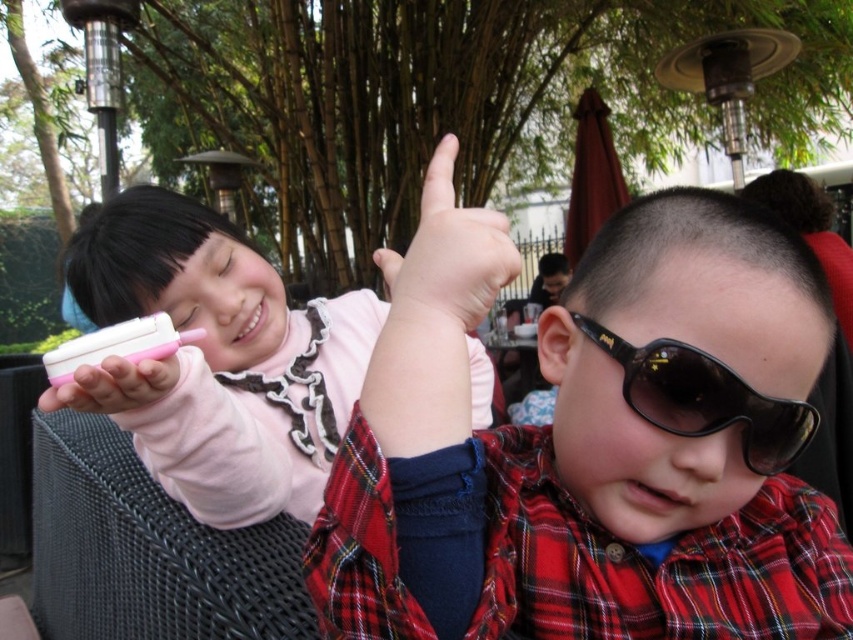
Question: Which object is positioned closest to the pink matte hand at upper center?

Choices:
 (A) pink matte phone at upper left
 (B) pink matte ice cream at center
 (C) plaid shirt at center

Answer: (C)

Question: Can you confirm if green bamboo forest at upper center is positioned to the right of pink matte ice cream at center?

Choices:
 (A) yes
 (B) no

Answer: (A)

Question: Which point is farther from the camera taking this photo?

Choices:
 (A) tap(399, 273)
 (B) tap(421, 285)

Answer: (A)

Question: Can you confirm if black plastic goggles at center is positioned to the right of pink matte hand at upper center?

Choices:
 (A) yes
 (B) no

Answer: (A)

Question: Does green bamboo forest at upper center have a greater width compared to black plastic goggles at center?

Choices:
 (A) no
 (B) yes

Answer: (B)

Question: Which of these objects is positioned closest to the black plastic goggles at center?

Choices:
 (A) pink matte hand at upper center
 (B) pink matte ice cream at center

Answer: (A)